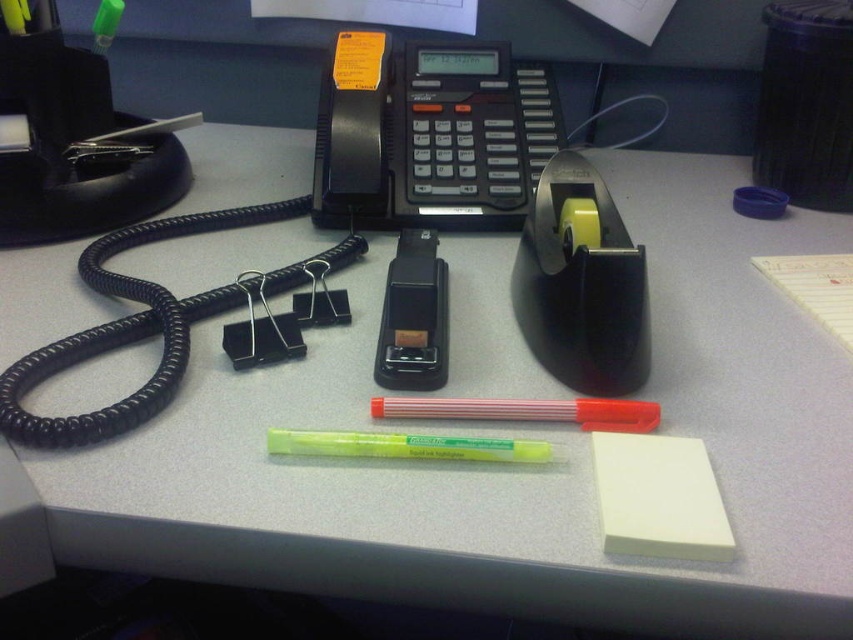
Question: Which point is closer to the camera?

Choices:
 (A) white matte notepad at lower right
 (B) translucent red highlighter at center
 (C) yellow highlighter at center
 (D) black plastic phone at center

Answer: (A)

Question: Is black plastic phone at center above translucent red highlighter at center?

Choices:
 (A) no
 (B) yes

Answer: (B)

Question: Considering the relative positions of black plastic phone at center and white matte notepad at lower right in the image provided, where is black plastic phone at center located with respect to white matte notepad at lower right?

Choices:
 (A) left
 (B) right

Answer: (A)

Question: Observing the image, what is the correct spatial positioning of white matte notepad at lower right in reference to yellow highlighter at center?

Choices:
 (A) above
 (B) below

Answer: (B)

Question: Which of the following is the closest to the observer?

Choices:
 (A) (679, 452)
 (B) (409, 397)
 (C) (531, 458)

Answer: (A)

Question: Which of the following is the closest to the observer?

Choices:
 (A) (618, 548)
 (B) (428, 442)
 (C) (573, 413)
 (D) (401, 138)

Answer: (A)